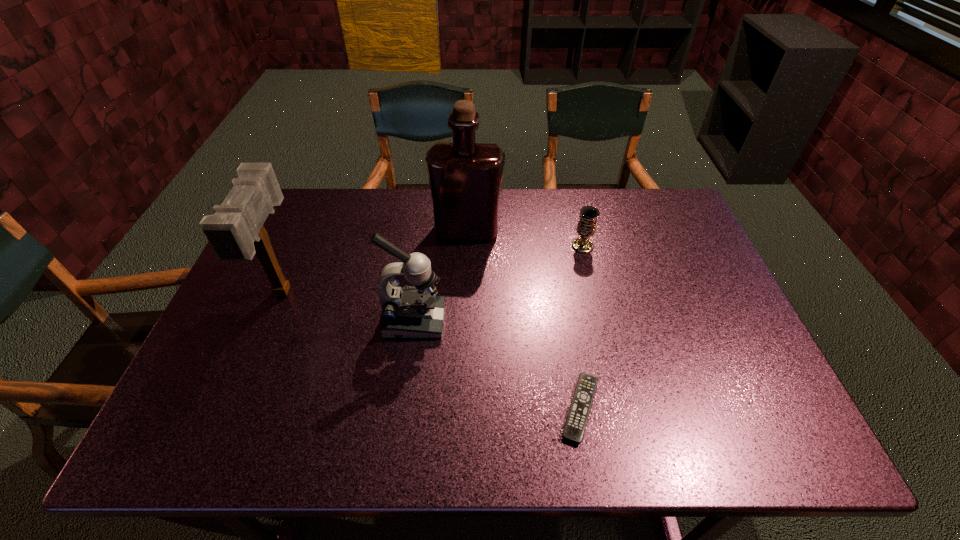
Where is `empty space that is in between the nearest object and the second shortest object`? empty space that is in between the nearest object and the second shortest object is located at coordinates (581, 327).

I want to click on object that is the third closest to the mallet, so click(x=575, y=425).

The height and width of the screenshot is (540, 960). I want to click on object that can be found as the second closest to the leftmost object, so click(x=465, y=177).

Image resolution: width=960 pixels, height=540 pixels. I want to click on vacant area that satisfies the following two spatial constraints: 1. on the front side of the liquor; 2. on the left side of the rightmost object, so click(x=467, y=246).

Locate an element on the screen. The image size is (960, 540). vacant space that satisfies the following two spatial constraints: 1. on the back side of the leftmost object; 2. on the right side of the liquor is located at coordinates (309, 230).